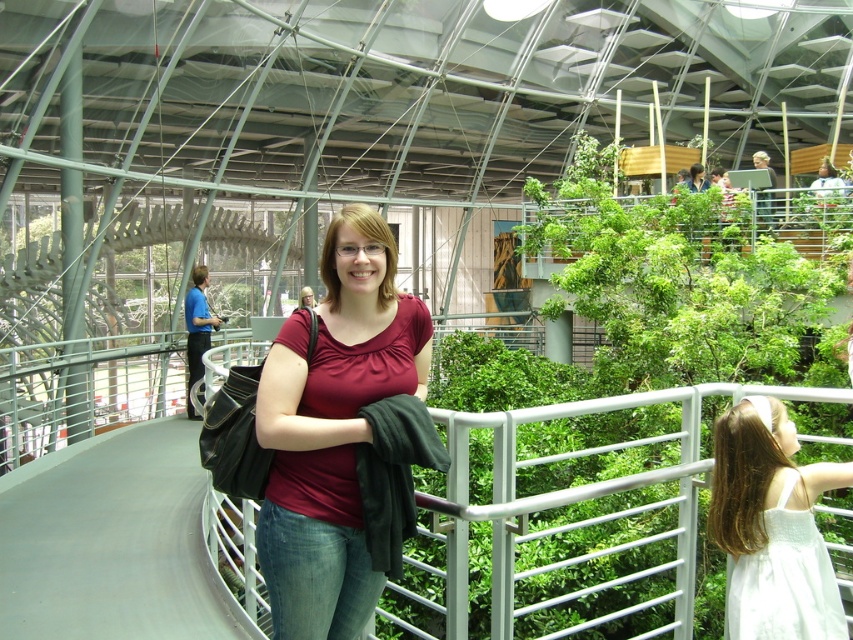
Is matte red blouse at center positioned before white satin dress at lower right?

Yes, matte red blouse at center is closer to the viewer.

Who is positioned more to the right, matte red blouse at center or white satin dress at lower right?

white satin dress at lower right

Which is in front, point (294, 554) or point (819, 492)?

Point (294, 554) is in front.

Find the location of a particular element. This screenshot has width=853, height=640. matte red blouse at center is located at coordinates (332, 429).

Between white satin dress at lower right and matte red shirt at center, which one is positioned higher?

matte red shirt at center is above.

Which is in front, point (727, 483) or point (308, 307)?

Point (308, 307) is in front.

I want to click on white satin dress at lower right, so click(x=772, y=525).

Consider the image. Can you confirm if matte red blouse at center is bigger than matte red shirt at center?

No, matte red blouse at center is not bigger than matte red shirt at center.

Between point (334, 634) and point (308, 300), which one is positioned behind?

The point (308, 300) is more distant.

Who is more distant from viewer, (296, 516) or (305, 292)?

Point (305, 292)

Where is `matte red blouse at center`? matte red blouse at center is located at coordinates (332, 429).